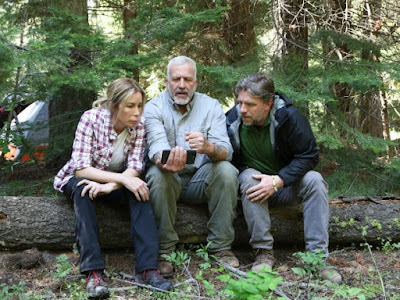
This screenshot has height=300, width=400. Find the location of `phone`. phone is located at coordinates (187, 157).